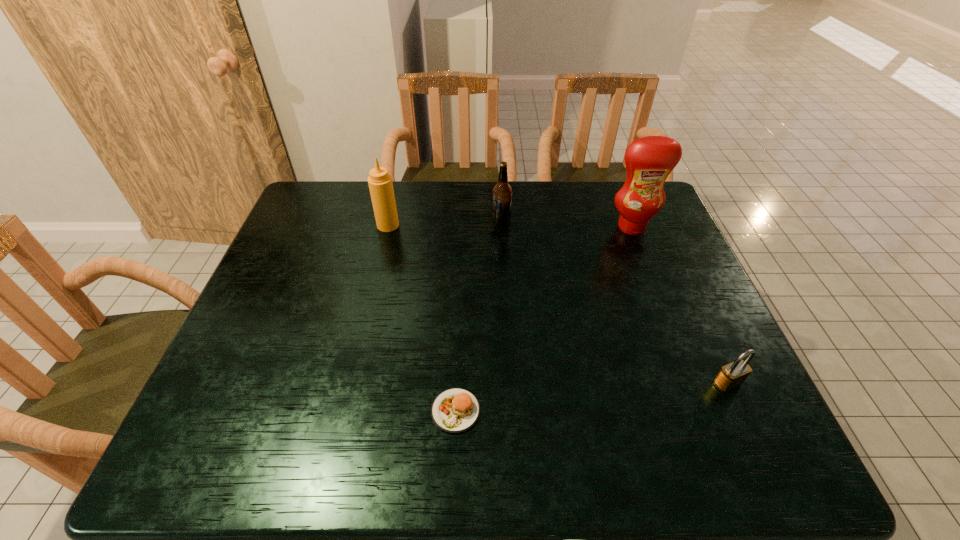
Identify the location of blank space at the far edge of the desktop. pyautogui.click(x=438, y=186).

Where is `vacant region at the near edge of the desktop`? Image resolution: width=960 pixels, height=540 pixels. vacant region at the near edge of the desktop is located at coordinates (428, 433).

Where is `vacant area at the left edge`? vacant area at the left edge is located at coordinates (292, 259).

Find the location of `blank space at the right edge of the desktop`. blank space at the right edge of the desktop is located at coordinates (668, 271).

The height and width of the screenshot is (540, 960). Find the location of `vacant point at the far left corner`. vacant point at the far left corner is located at coordinates (332, 217).

I want to click on free point between the patty and the left condiment, so click(421, 318).

The image size is (960, 540). What are the coordinates of `empty space between the patty and the second shortest object` in the screenshot? It's located at (591, 397).

Identify the location of vacant area that lies between the patty and the fourth tallest object. This screenshot has width=960, height=540. (591, 397).

The height and width of the screenshot is (540, 960). Identify the location of vacant area that lies between the fourth tallest object and the tallest object. (680, 305).

Locate an element on the screen. vacant point located between the padlock and the tallest object is located at coordinates (680, 305).